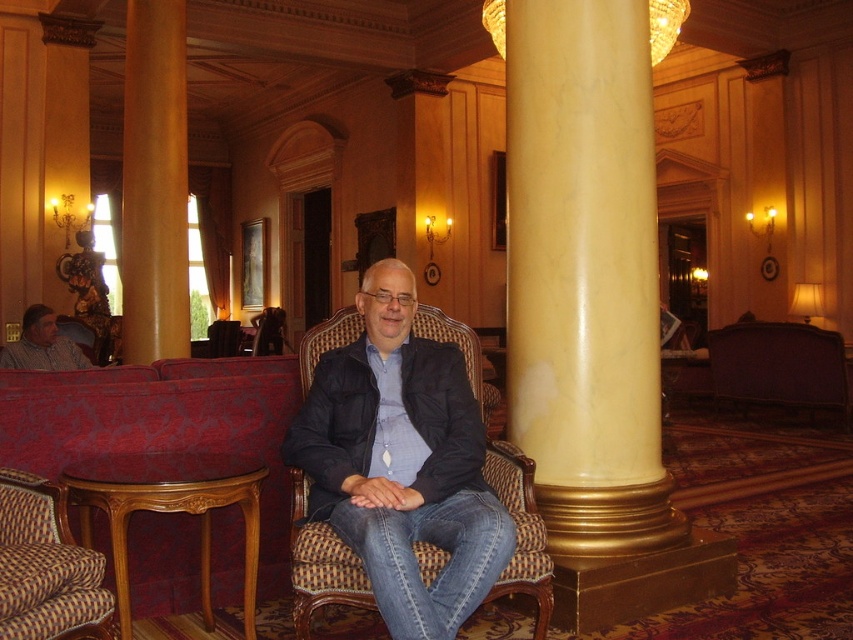
Is plaid fabric armchair at lower left bigger than matte black shirt at lower left?

No, plaid fabric armchair at lower left is not bigger than matte black shirt at lower left.

Who is more forward, [19,528] or [68,355]?

Point [19,528] is more forward.

Who is more forward, [67,566] or [64,353]?

Point [67,566] is more forward.

This screenshot has width=853, height=640. In order to click on plaid fabric armchair at lower left in this screenshot , I will do `click(45, 566)`.

Is wooden polished stool at lower left further to camera compared to purple velvet couch at right?

No, wooden polished stool at lower left is closer to the viewer.

Is wooden polished stool at lower left wider than purple velvet couch at right?

Incorrect, wooden polished stool at lower left's width does not surpass purple velvet couch at right's.

This screenshot has width=853, height=640. What do you see at coordinates (169, 509) in the screenshot?
I see `wooden polished stool at lower left` at bounding box center [169, 509].

Locate an element on the screen. This screenshot has width=853, height=640. wooden polished stool at lower left is located at coordinates (169, 509).

Is point (126, 26) behind point (463, 509)?

Yes, it is behind point (463, 509).

Between point (178, 154) and point (450, 602), which one is positioned behind?

Positioned behind is point (178, 154).

Which is behind, point (172, 234) or point (337, 529)?

Positioned behind is point (172, 234).

At what (x,y) coordinates should I click in order to perform the action: click on yellow marble column at left. Please return your answer as a coordinate pair (x, y). This screenshot has width=853, height=640. Looking at the image, I should click on (154, 182).